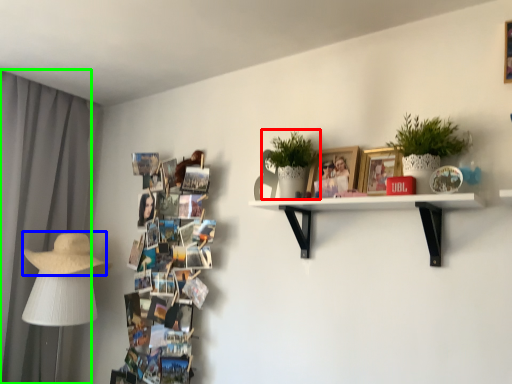
Question: Which object is the closest to the houseplant (highlighted by a red box)? Choose among these: straw hat (highlighted by a blue box) or curtain (highlighted by a green box).

Choices:
 (A) straw hat
 (B) curtain

Answer: (A)